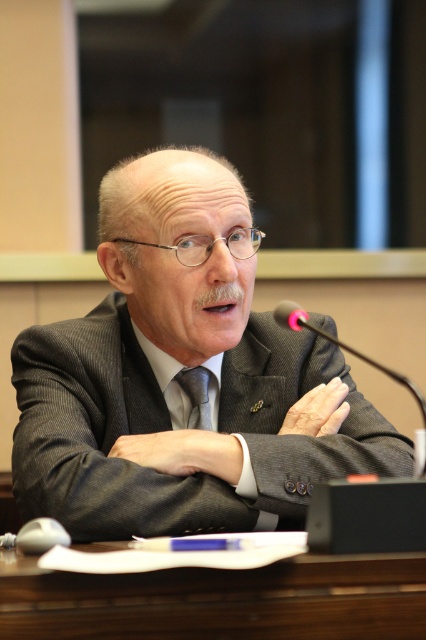
Does matte gray suit at center have a smaller size compared to brown wooden table at center?

Incorrect, matte gray suit at center is not smaller in size than brown wooden table at center.

Where is `matte gray suit at center`? The height and width of the screenshot is (640, 426). matte gray suit at center is located at coordinates (178, 371).

I want to click on matte gray suit at center, so click(x=178, y=371).

Does brown wooden table at center have a greater width compared to silky gray tie at center?

Yes, brown wooden table at center is wider than silky gray tie at center.

Who is positioned more to the right, brown wooden table at center or silky gray tie at center?

brown wooden table at center

Which is in front, point (371, 616) or point (189, 380)?

Point (371, 616) is more forward.

Locate an element on the screen. The height and width of the screenshot is (640, 426). brown wooden table at center is located at coordinates (219, 600).

Between matte gray suit at center and silky gray tie at center, which one is positioned higher?

matte gray suit at center

The image size is (426, 640). What do you see at coordinates (178, 371) in the screenshot? I see `matte gray suit at center` at bounding box center [178, 371].

The width and height of the screenshot is (426, 640). What are the coordinates of `matte gray suit at center` in the screenshot? It's located at (178, 371).